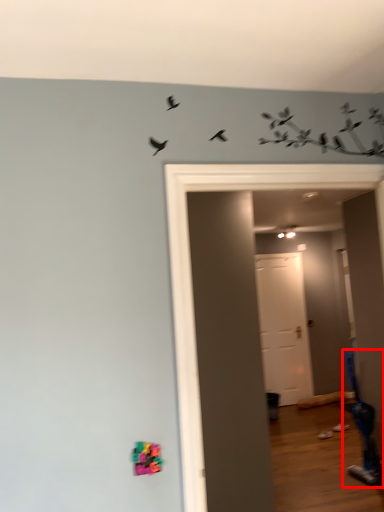
Question: From the image's perspective, where is swivel chair (annotated by the red box) located relative to door?

Choices:
 (A) above
 (B) below

Answer: (B)